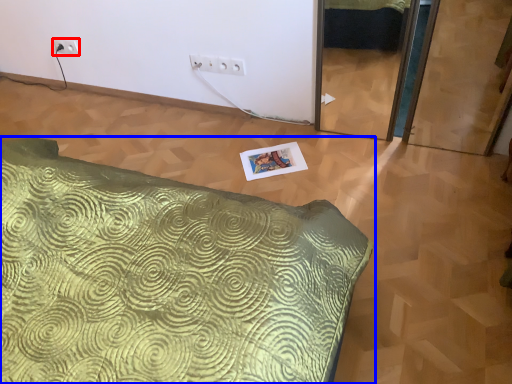
Question: Among these objects, which one is nearest to the camera, electric outlet (highlighted by a red box) or bed (highlighted by a blue box)?

Choices:
 (A) electric outlet
 (B) bed

Answer: (B)